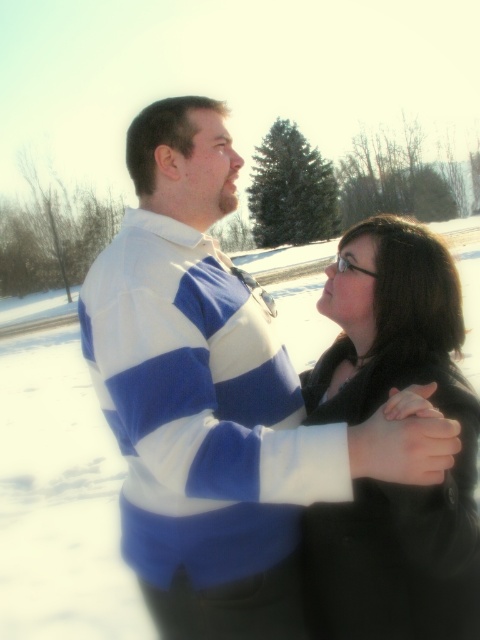
You are designing a new clothing line and want to ensure that the blue striped sweater at center and the black matte coat at center can be worn together. Based on their sizes, which one would you recommend as the outer layer?

The blue striped sweater at center is bigger than the black matte coat at center, so the blue striped sweater at center would be the better choice as the outer layer since it can accommodate the smaller coat underneath.

You are an artist trying to sketch the scene. You need to place the blue striped sweater at center in your drawing. According to the coordinates provided, where should you position it on the canvas?

The blue striped sweater at center should be placed at the coordinates point 0.623 on the x axis and 0.452 on the y axis.

You are standing in the snowy landscape and want to place a small decoration exactly halfway between the two points, point (168,467) and point (379,234). Considering their positions, will the decoration be closer to the viewer or farther away from you?

The decoration placed halfway between point (168,467) and point (379,234) will be closer to the viewer than point (379,234) but farther than point (168,467). Since point (168,467) is closer to the viewer, the midpoint will be somewhere in between their distances.